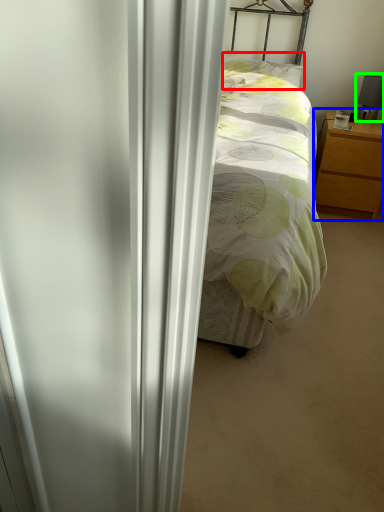
Question: Estimate the real-world distances between objects in this image. Which object is farther from pillow (highlighted by a red box), nightstand (highlighted by a blue box) or table lamp (highlighted by a green box)?

Choices:
 (A) nightstand
 (B) table lamp

Answer: (A)